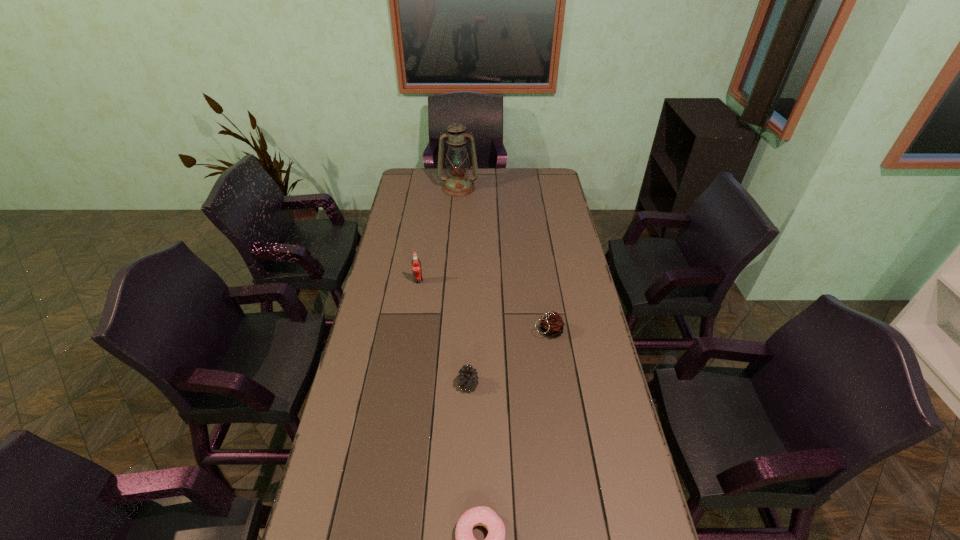
Locate an element on the screen. This screenshot has height=540, width=960. vacant space located 0.210m with a leaf charm attached to the farther pinecone is located at coordinates (473, 331).

This screenshot has height=540, width=960. I want to click on free space located with a leaf charm attached to the farther pinecone, so click(482, 331).

You are a GUI agent. You are given a task and a screenshot of the screen. Output one action in this format:
    pyautogui.click(x=<x>, y=<y>)
    Task: Click on the free spot located with a leaf charm attached to the farther pinecone
    Image resolution: width=960 pixels, height=540 pixels.
    Given the screenshot: What is the action you would take?
    pyautogui.click(x=419, y=331)

What are the coordinates of `free point located on the right of the nearer pinecone` in the screenshot? It's located at (534, 385).

Identify the location of object that is positioned at the far edge. pyautogui.click(x=458, y=184).

This screenshot has height=540, width=960. What are the coordinates of `object present at the left edge` in the screenshot? It's located at (416, 264).

This screenshot has height=540, width=960. Identify the location of object that is positioned at the right edge. (552, 324).

This screenshot has width=960, height=540. I want to click on free space at the far edge, so click(495, 191).

At what (x,y) coordinates should I click in order to perform the action: click on vacant space at the left edge. Please return your answer as a coordinate pair (x, y). This screenshot has width=960, height=540. Looking at the image, I should click on (389, 350).

In the image, there is a desktop. At what (x,y) coordinates should I click in order to perform the action: click on vacant space at the right edge. Please return your answer as a coordinate pair (x, y). Looking at the image, I should click on pyautogui.click(x=534, y=207).